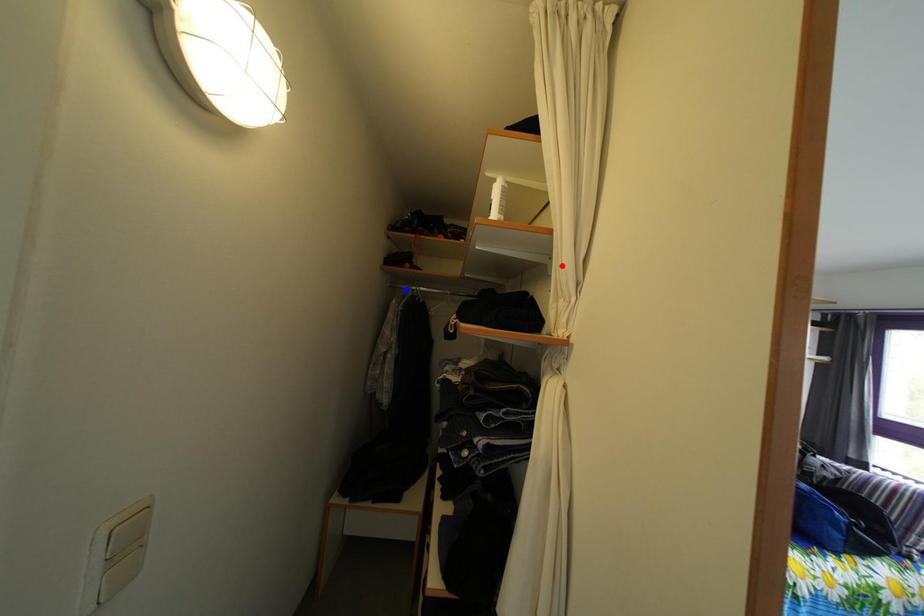
Question: Two points are marked on the image. Which point is closer to the camera?

Choices:
 (A) Blue point is closer.
 (B) Red point is closer.

Answer: (B)